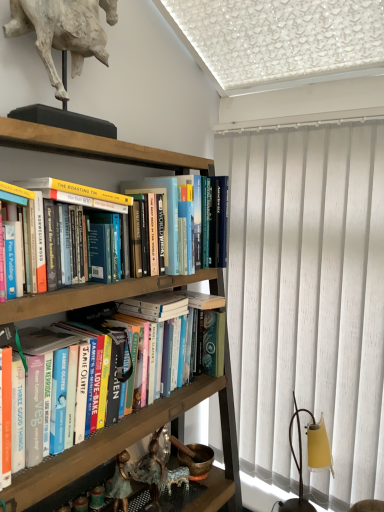
Question: Can you confirm if wooden bookshelf at upper left is bigger than white vertical blinds at right?

Choices:
 (A) yes
 (B) no

Answer: (A)

Question: Would you say wooden bookshelf at upper left contains white vertical blinds at right?

Choices:
 (A) no
 (B) yes

Answer: (A)

Question: Is wooden bookshelf at upper left placed right next to white vertical blinds at right?

Choices:
 (A) no
 (B) yes

Answer: (A)

Question: Does wooden bookshelf at upper left have a lesser width compared to white vertical blinds at right?

Choices:
 (A) yes
 (B) no

Answer: (B)

Question: Is the position of wooden bookshelf at upper left more distant than that of white vertical blinds at right?

Choices:
 (A) no
 (B) yes

Answer: (A)

Question: Considering the positions of white vertical blinds at right and hardcover books at center, which is the second book in top-to-bottom order, in the image, is white vertical blinds at right wider or thinner than hardcover books at center, which is the second book in top-to-bottom order,?

Choices:
 (A) thin
 (B) wide

Answer: (A)

Question: Is white vertical blinds at right bigger or smaller than hardcover books at center, which is the second book in top-to-bottom order?

Choices:
 (A) big
 (B) small

Answer: (A)

Question: From a real-world perspective, relative to hardcover books at center, which appears as the 1th book when ordered from the bottom, is white vertical blinds at right vertically above or below?

Choices:
 (A) below
 (B) above

Answer: (B)

Question: In the image, is white vertical blinds at right positioned in front of or behind hardcover books at center, which is the second book in top-to-bottom order?

Choices:
 (A) behind
 (B) front

Answer: (A)

Question: Would you say white vertical blinds at right is to the left or to the right of white plaster horse at upper left in the picture?

Choices:
 (A) right
 (B) left

Answer: (A)

Question: Considering the positions of white vertical blinds at right and white plaster horse at upper left in the image, is white vertical blinds at right wider or thinner than white plaster horse at upper left?

Choices:
 (A) wide
 (B) thin

Answer: (B)

Question: From a real-world perspective, is white vertical blinds at right physically located above or below white plaster horse at upper left?

Choices:
 (A) below
 (B) above

Answer: (A)

Question: Would you say white vertical blinds at right is inside or outside white plaster horse at upper left?

Choices:
 (A) inside
 (B) outside

Answer: (B)

Question: Considering the positions of point (51, 479) and point (309, 296), is point (51, 479) closer or farther from the camera than point (309, 296)?

Choices:
 (A) closer
 (B) farther

Answer: (A)

Question: Considering the positions of hardcover books at center, which is the second book in top-to-bottom order, and white vertical blinds at right in the image, is hardcover books at center, which is the second book in top-to-bottom order, taller or shorter than white vertical blinds at right?

Choices:
 (A) tall
 (B) short

Answer: (B)